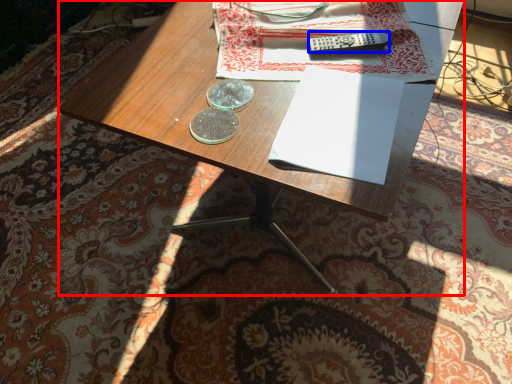
Question: Among these objects, which one is nearest to the camera, desk (highlighted by a red box) or remote control (highlighted by a blue box)?

Choices:
 (A) desk
 (B) remote control

Answer: (A)